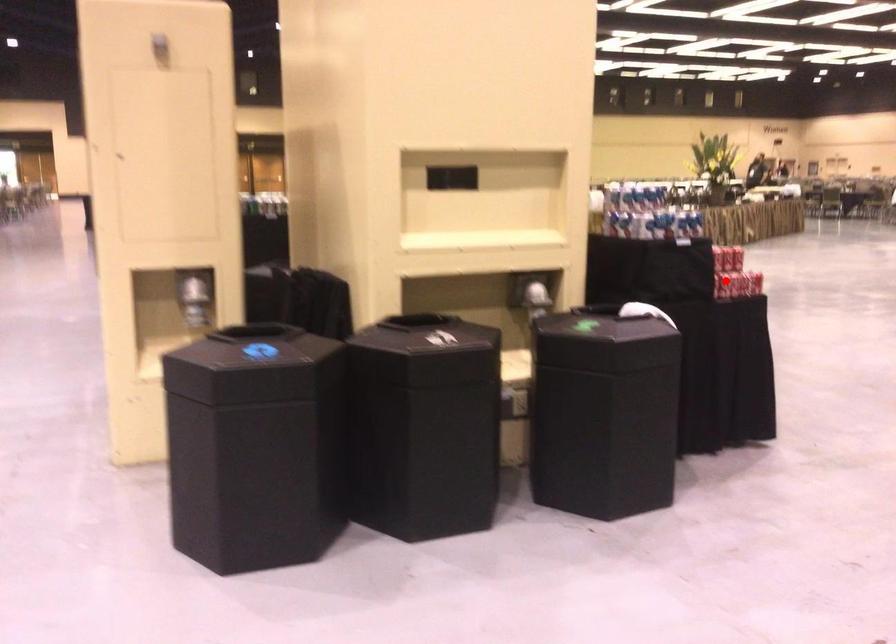
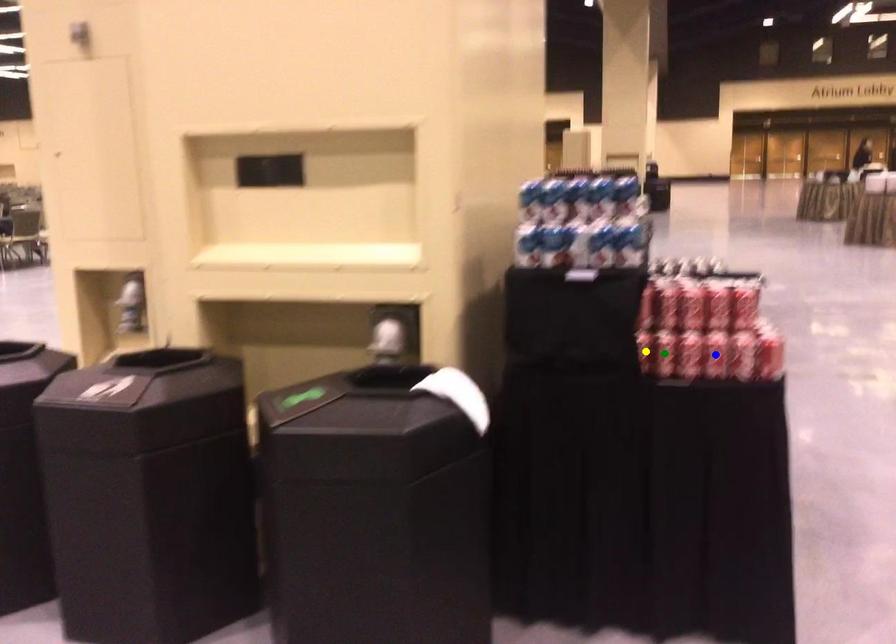
Question: I am providing you with two images of the same scene from different viewpoints. A red point is marked on the first image. You are given multiple points on the second image. Which spot in image 2 lines up with the point in image 1?

Choices:
 (A) green point
 (B) yellow point
 (C) blue point

Answer: (B)